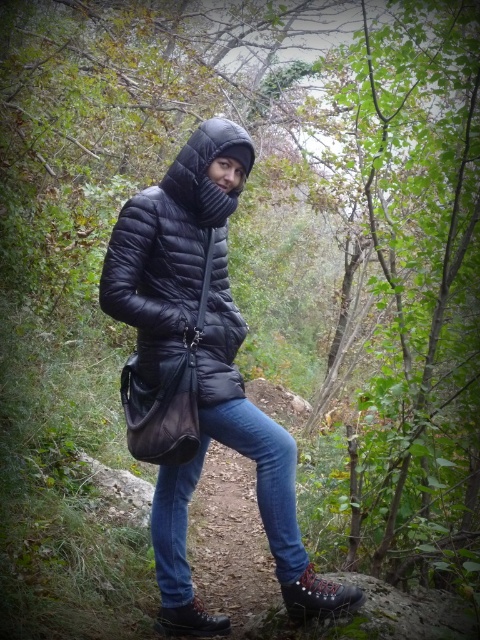
You are a photographer trying to capture the person in the scene. You need to ensure that both the matte black jacket at center and the black quilted hood at center are clearly visible in the frame. Which object should you focus on first to ensure both are in focus?

The black quilted hood at center is located above the matte black jacket at center. To ensure both are in focus, you should focus on the black quilted hood at center first since it is higher up and closer to the camera, allowing the jacket below to stay in the same focal plane.

You are a photographer setting up a shot of the person in the forest. You notice the matte black puffer jacket at center and the blue denim jeans at center. Which clothing item is positioned more to the left side of the image?

The matte black puffer jacket at center is to the left of the blue denim jeans at center, so the matte black puffer jacket at center is positioned more to the left side of the image.

You are a photographer trying to capture the person in the matte black jacket at center. The camera you are using has a limited field of view. The camera can only focus on objects within a 0.5x0.5 area centered at point (200, 372). Will the matte black jacket at center be fully within the camera focus area?

The point (200, 372) is where the matte black jacket at center is located. Since the camera focuses on a 0.5x0.5 area centered at that point, the matte black jacket at center will be fully within the camera focus area as it is precisely at the center of the focus area.